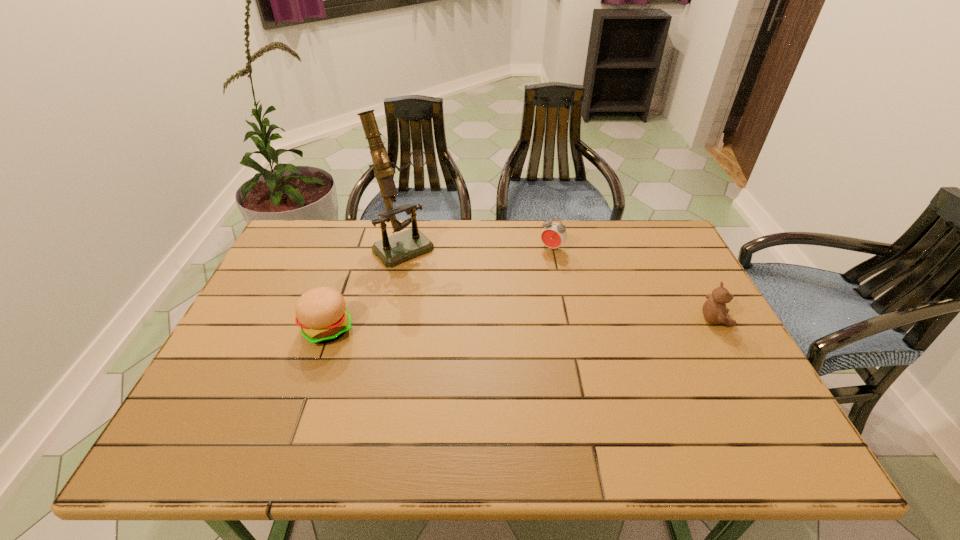
Locate an element on the screen. free spot on the desktop that is between the hamburger and the rightmost object and is positioned on the face of the third object from left to right is located at coordinates (498, 325).

Where is `free space on the desktop that is between the hamburger and the teddy bear and is positioned at the eyepiece of the microscope`? Image resolution: width=960 pixels, height=540 pixels. free space on the desktop that is between the hamburger and the teddy bear and is positioned at the eyepiece of the microscope is located at coordinates (480, 325).